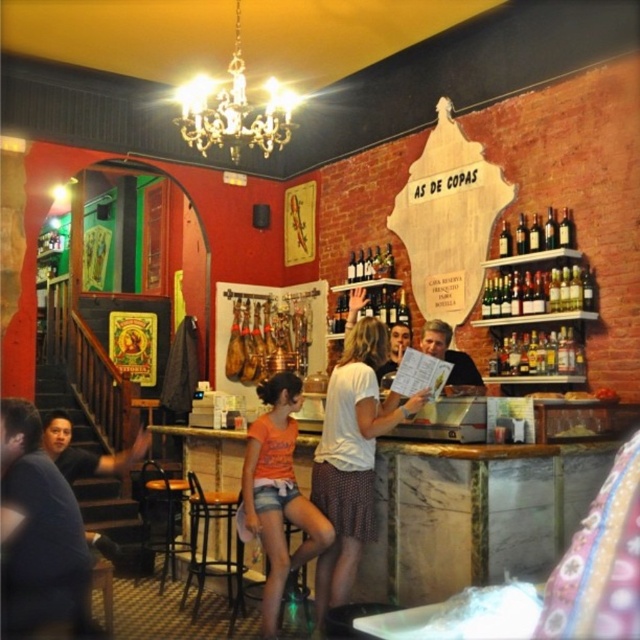
Between dark blue shirt at lower left and matte black shirt at left, which one is positioned lower?

dark blue shirt at lower left is lower down.

Who is more distant from viewer, (20, 531) or (48, 429)?

The point (48, 429) is more distant.

Find the location of a particular element. dark blue shirt at lower left is located at coordinates (38, 536).

Is wooden bar stool at center below matte black shirt at center?

Indeed, wooden bar stool at center is positioned under matte black shirt at center.

Who is lower down, wooden bar stool at center or matte black shirt at center?

wooden bar stool at center

Locate an element on the screen. This screenshot has width=640, height=640. wooden bar stool at center is located at coordinates (209, 548).

Between wooden seat at lower left and matte black shirt at left, which one has more height?

wooden seat at lower left

Between point (148, 472) and point (124, 451), which one is positioned in front?

Point (124, 451) is more forward.

The width and height of the screenshot is (640, 640). What are the coordinates of `wooden seat at lower left` in the screenshot? It's located at (163, 518).